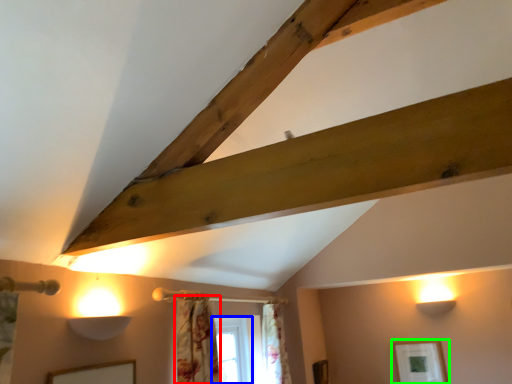
Question: Based on their relative distances, which object is nearer to curtain (highlighted by a red box)? Choose from window (highlighted by a blue box) and picture frame (highlighted by a green box).

Choices:
 (A) window
 (B) picture frame

Answer: (A)